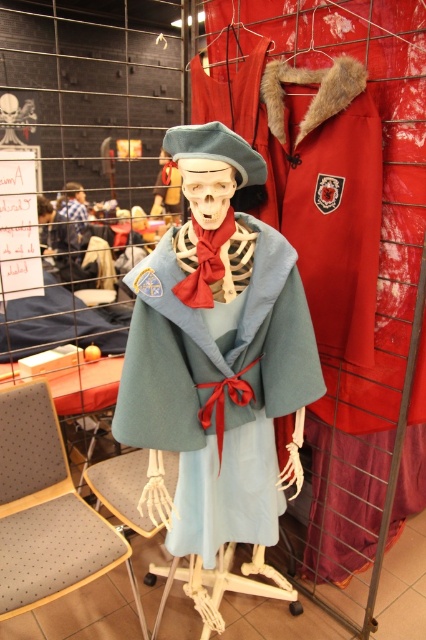
Question: From the image, what is the correct spatial relationship of light blue woolen cape at center in relation to blue plaid shirt at center?

Choices:
 (A) right
 (B) left

Answer: (A)

Question: Can you confirm if gray fabric chair at lower left is wider than blue plaid shirt at center?

Choices:
 (A) yes
 (B) no

Answer: (A)

Question: Which object is closer to the camera taking this photo?

Choices:
 (A) gray fabric chair at lower left
 (B) blue plaid shirt at center
 (C) light blue woolen cape at center

Answer: (C)

Question: Can you confirm if light blue woolen cape at center is positioned to the left of gray fabric chair at lower left?

Choices:
 (A) no
 (B) yes

Answer: (A)

Question: Among these points, which one is nearest to the camera?

Choices:
 (A) (172, 236)
 (B) (68, 202)

Answer: (A)

Question: Which point is farther to the camera?

Choices:
 (A) blue plaid shirt at center
 (B) light blue woolen cape at center

Answer: (A)